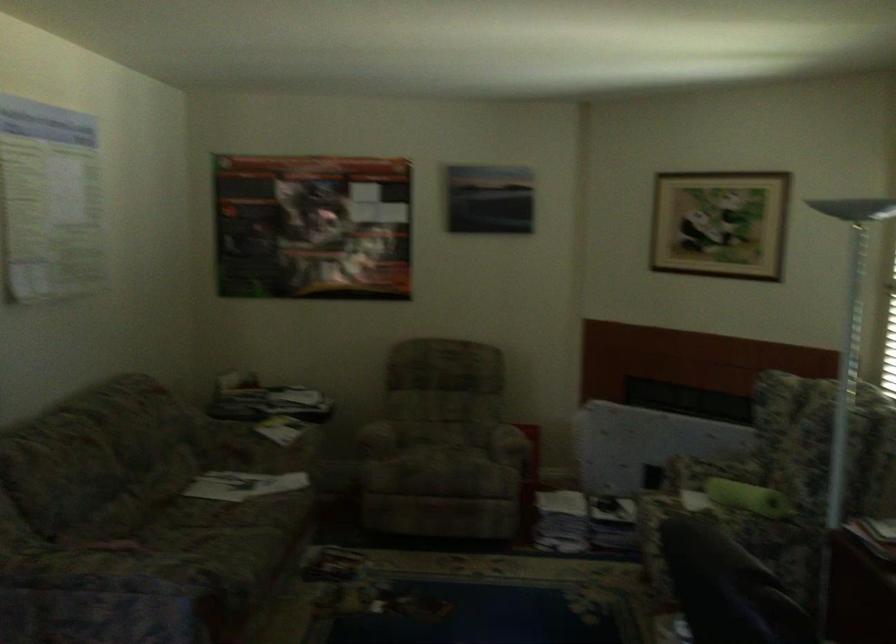
Image resolution: width=896 pixels, height=644 pixels. Describe the element at coordinates (436, 451) in the screenshot. I see `a chair sitting surface` at that location.